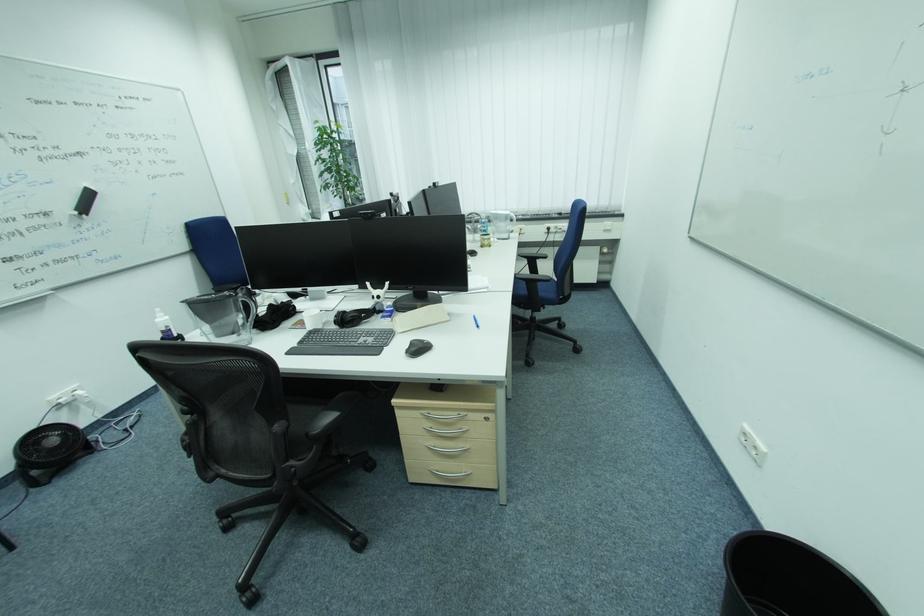
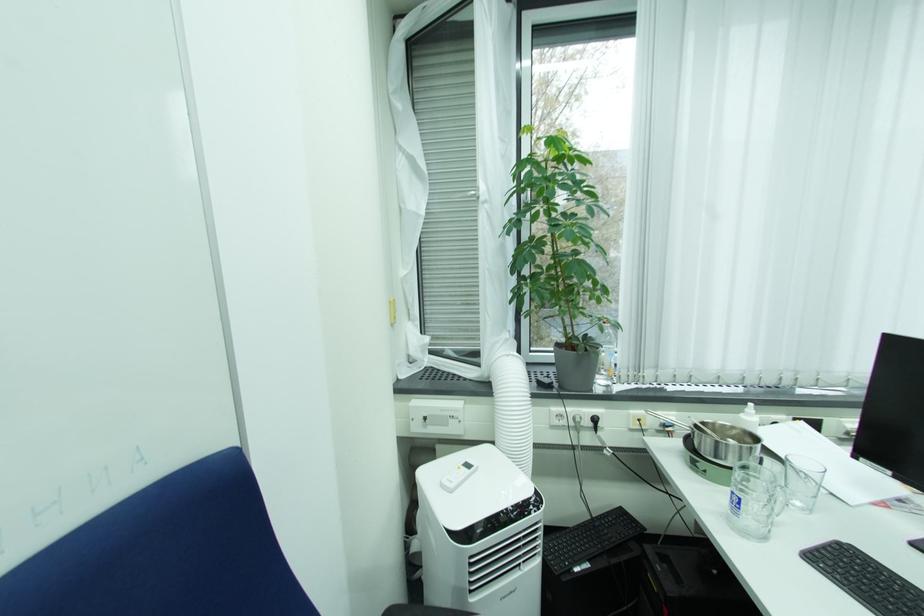
The images are taken continuously from a first-person perspective. In which direction are you moving?

The cameraman moved toward left, forward.